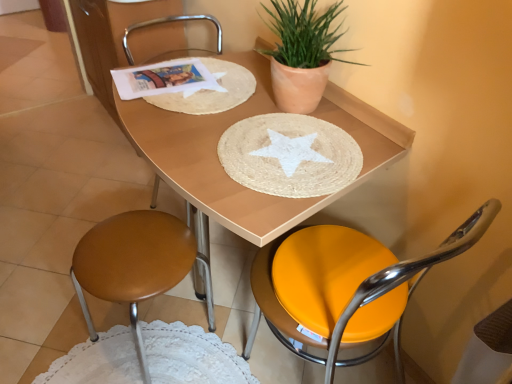
At what (x,y) coordinates should I click in order to perform the action: click on vacant area that is in front of white woven placemat at upper left, the second paper plate when ordered from bottom to top. Please return your answer as a coordinate pair (x, y). Image resolution: width=512 pixels, height=384 pixels. Looking at the image, I should click on (226, 148).